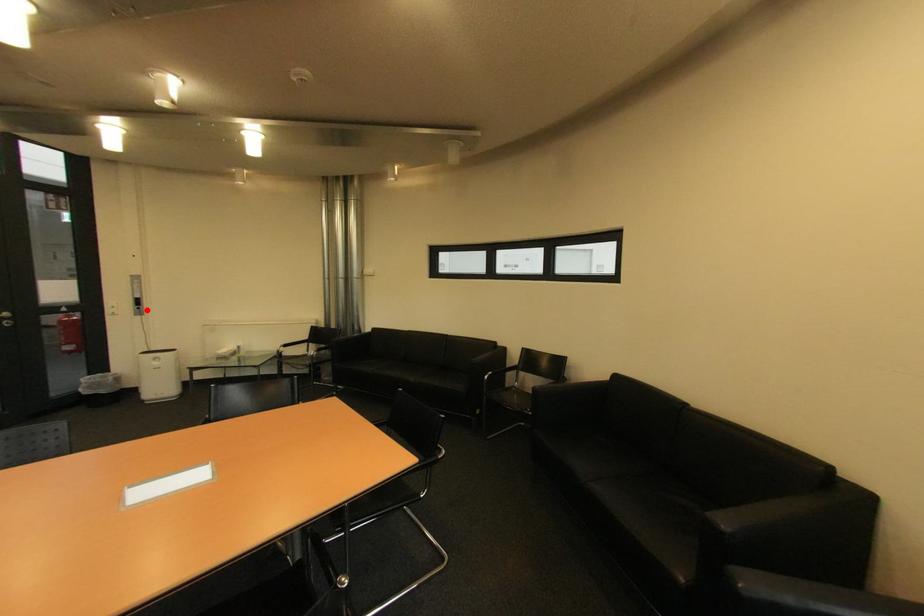
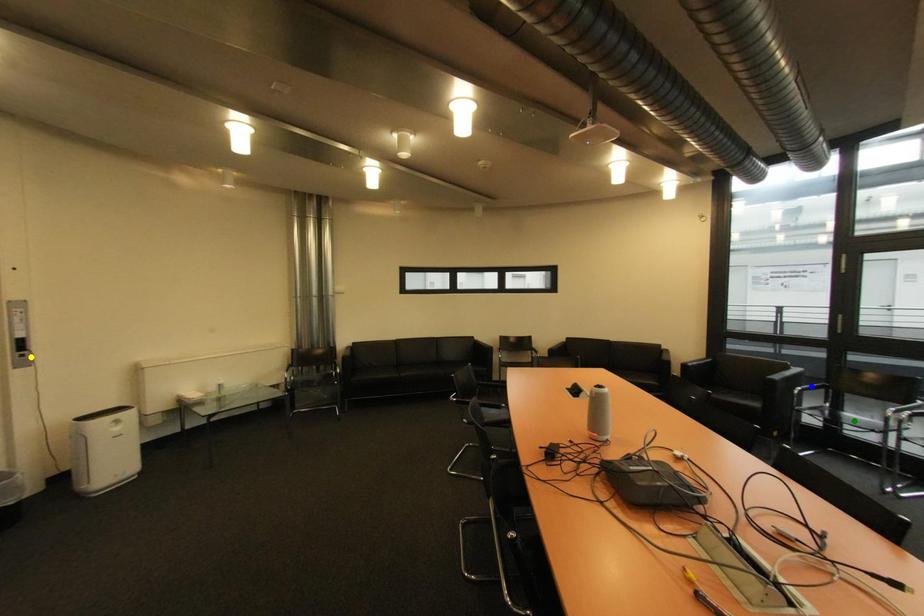
Question: I am providing you with two images of the same scene from different viewpoints. A red point is marked on the first image. You are given multiple points on the second image. Which point in image 2 represents the same 3d spot as the red point in image 1?

Choices:
 (A) yellow point
 (B) green point
 (C) blue point

Answer: (A)